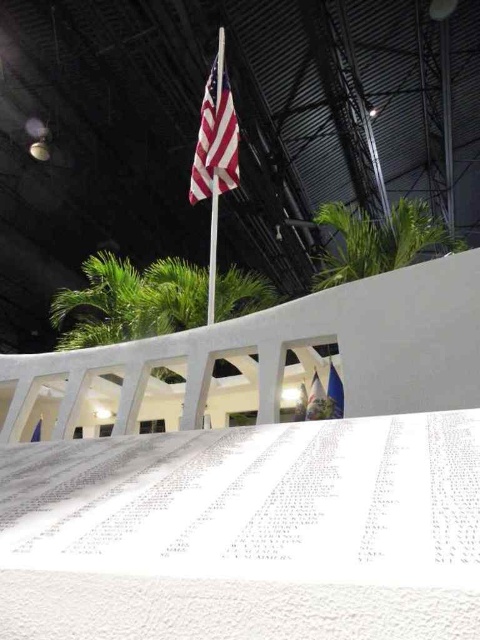
Question: Is american flag at upper center wider than white fabric flag at center?

Choices:
 (A) yes
 (B) no

Answer: (A)

Question: In this image, where is metallic silver flag pole at upper center located relative to blue fabric flag at center?

Choices:
 (A) left
 (B) right

Answer: (B)

Question: Which object is positioned closest to the green leafy palm tree at upper right?

Choices:
 (A) american flag at upper center
 (B) blue fabric flag at lower center
 (C) metallic silver flag pole at upper center

Answer: (A)

Question: Which of the following is the closest to the observer?

Choices:
 (A) pyautogui.click(x=313, y=388)
 (B) pyautogui.click(x=39, y=419)
 (C) pyautogui.click(x=208, y=300)
 (D) pyautogui.click(x=193, y=182)

Answer: (A)

Question: Estimate the real-world distances between objects in this image. Which object is farther from the white fabric flag at center?

Choices:
 (A) blue fabric flag at lower center
 (B) blue fabric flag at center

Answer: (B)

Question: Is white fabric flag at center above blue fabric flag at center?

Choices:
 (A) yes
 (B) no

Answer: (A)